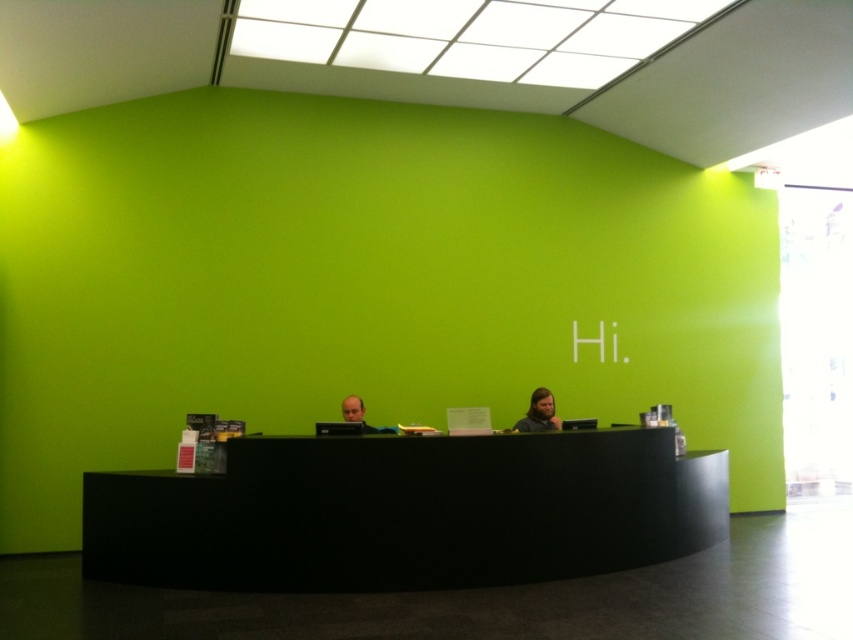
Question: Can you confirm if dark brown hair at center is positioned to the left of matte black laptop at center?

Choices:
 (A) yes
 (B) no

Answer: (B)

Question: Which point is farther from the camera taking this photo?

Choices:
 (A) (375, 566)
 (B) (547, 428)

Answer: (B)

Question: Which point is farther from the camera taking this photo?

Choices:
 (A) (177, 557)
 (B) (357, 412)

Answer: (B)

Question: Can you confirm if black matte desk at center is smaller than matte black laptop at center?

Choices:
 (A) no
 (B) yes

Answer: (A)

Question: Is the position of dark brown hair at center more distant than that of matte black laptop at center?

Choices:
 (A) no
 (B) yes

Answer: (B)

Question: Among these points, which one is nearest to the camera?

Choices:
 (A) (538, 392)
 (B) (375, 426)
 (C) (430, 452)

Answer: (C)